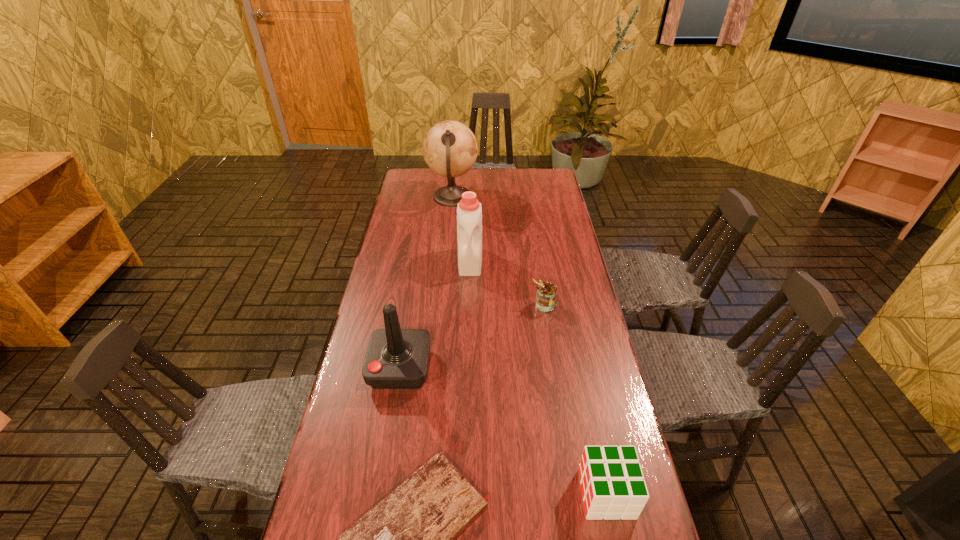
Locate an element on the screen. The image size is (960, 540). free space at the left edge of the desktop is located at coordinates (396, 211).

This screenshot has width=960, height=540. Identify the location of vacant space at the right edge of the desktop. (543, 253).

Image resolution: width=960 pixels, height=540 pixels. In order to click on vacant space at the far left corner in this screenshot , I will do `click(436, 186)`.

Image resolution: width=960 pixels, height=540 pixels. Find the location of `free region at the far right corner of the desktop`. free region at the far right corner of the desktop is located at coordinates (551, 174).

Locate an element on the screen. The width and height of the screenshot is (960, 540). vacant area that lies between the joystick and the third farthest object is located at coordinates (472, 336).

The image size is (960, 540). Identify the location of free space between the cube and the farthest object. (529, 346).

I want to click on vacant point located between the cube and the detergent, so click(539, 377).

Where is `free space between the joystick and the farthest object`? The width and height of the screenshot is (960, 540). free space between the joystick and the farthest object is located at coordinates (426, 282).

At what (x,y) coordinates should I click in order to perform the action: click on vacant region between the tallest object and the third farthest object. Please return your answer as a coordinate pair (x, y). This screenshot has height=540, width=960. Looking at the image, I should click on (498, 251).

At what (x,y) coordinates should I click in order to perform the action: click on the second closest object to the Bible. Please return your answer as a coordinate pair (x, y). The image size is (960, 540). Looking at the image, I should click on (612, 482).